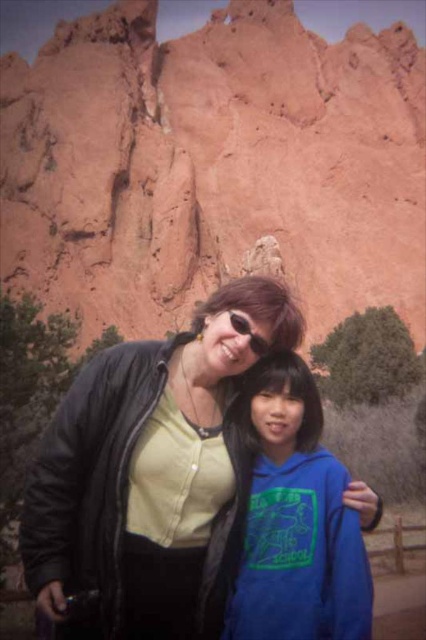
Question: Among these objects, which one is farthest from the camera?

Choices:
 (A) black leather jacket at center
 (B) matte black goggles at upper center

Answer: (B)

Question: Is black leather jacket at center behind matte black goggles at upper center?

Choices:
 (A) no
 (B) yes

Answer: (A)

Question: Can you confirm if rustic rock formation at upper center is smaller than blue fleece hoodie at center?

Choices:
 (A) yes
 (B) no

Answer: (B)

Question: Which object is closer to the camera taking this photo?

Choices:
 (A) matte black goggles at upper center
 (B) blue fleece hoodie at center

Answer: (B)

Question: Estimate the real-world distances between objects in this image. Which object is closer to the rustic rock formation at upper center?

Choices:
 (A) blue fleece hoodie at center
 (B) black leather jacket at center
 (C) matte black goggles at upper center

Answer: (B)

Question: Where is black leather jacket at center located in relation to blue fleece hoodie at center in the image?

Choices:
 (A) below
 (B) above

Answer: (B)